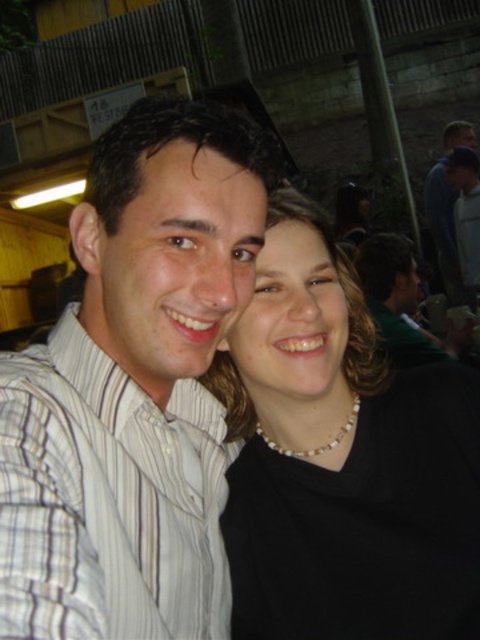
Can you confirm if pearl necklace at center is positioned to the right of dark blue shirt at upper right?

In fact, pearl necklace at center is to the left of dark blue shirt at upper right.

Identify the location of pearl necklace at center. The image size is (480, 640). (342, 460).

Does point (340, 314) come closer to viewer compared to point (464, 131)?

Yes, point (340, 314) is closer to viewer.

In order to click on pearl necklace at center in this screenshot , I will do click(x=342, y=460).

Can you confirm if pearl necklace at center is wider than white striped shirt at left?

Indeed, pearl necklace at center has a greater width compared to white striped shirt at left.

Identify the location of pearl necklace at center. This screenshot has height=640, width=480. (342, 460).

Locate an element on the screen. The width and height of the screenshot is (480, 640). pearl necklace at center is located at coordinates (342, 460).

Which is in front, point (389, 259) or point (448, 250)?

Point (389, 259) is in front.

This screenshot has width=480, height=640. I want to click on matte black shirt at upper right, so click(395, 298).